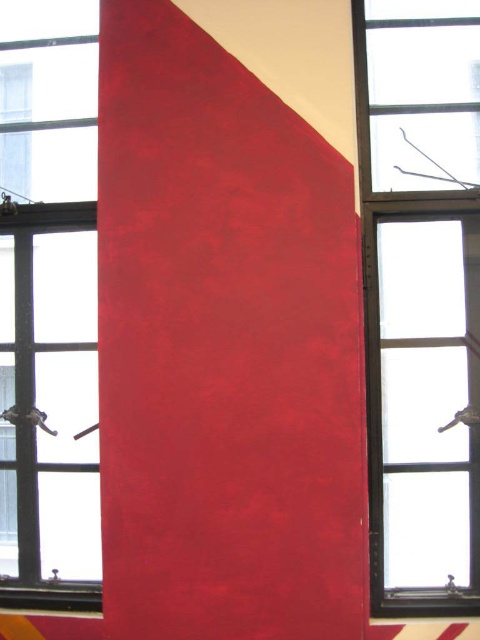
You are standing in a room with a red wall and two windows. You see the clear glass window at center and the transparent glass window at center. Which one is positioned to the right?

The clear glass window at center is to the right of the transparent glass window at center.

You are standing in the room depicted in the image and want to determine the spatial relationship between two specific points marked on the wall. The first point is at coordinates point (459,280) and the second is at point (24,404). From your vantage point, which point appears closer to you?

Point (459,280) is in front of point (24,404), so it appears closer to you.

You are standing in a room with a bold red wall. There is a clear glass window at center. Based on the coordinates provided, is the window closer to the top or bottom edge of the red wall?

The clear glass window at center is located at point [420,298]. Since the y coordinate is closer to 1, it is closer to the bottom edge of the red wall.